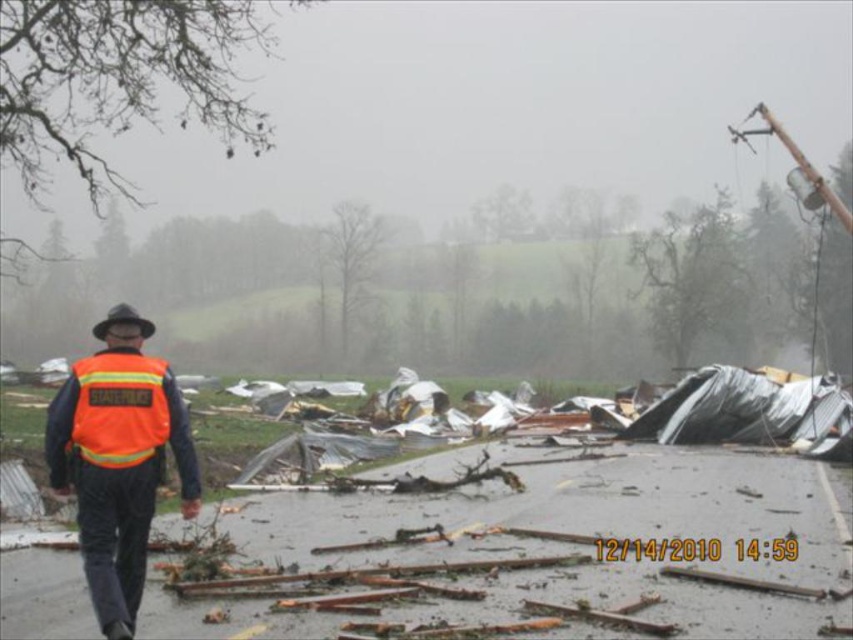
Is point (102, 566) positioned in front of point (144, 339)?

That is True.

Who is more distant from viewer, (115, 385) or (138, 326)?

The point (138, 326) is more distant.

The width and height of the screenshot is (853, 640). In order to click on orange reflective vest at left in this screenshot , I will do `click(119, 465)`.

Does point (140, 536) come in front of point (166, 417)?

Yes, it is in front of point (166, 417).

Is orange reflective vest at left in front of orange reflective safety vest at left?

That is False.

Locate an element on the screen. orange reflective vest at left is located at coordinates (119, 465).

Find the location of `orange reflective vest at left`. orange reflective vest at left is located at coordinates (119, 465).

Who is lower down, orange reflective safety vest at left or black felt hat at upper left?

orange reflective safety vest at left is below.

Looking at this image, is the position of orange reflective safety vest at left more distant than that of black felt hat at upper left?

No, it is not.

Does point (120, 365) come in front of point (115, 320)?

Yes, point (120, 365) is in front of point (115, 320).

This screenshot has height=640, width=853. Find the location of `orange reflective safety vest at left`. orange reflective safety vest at left is located at coordinates (119, 408).